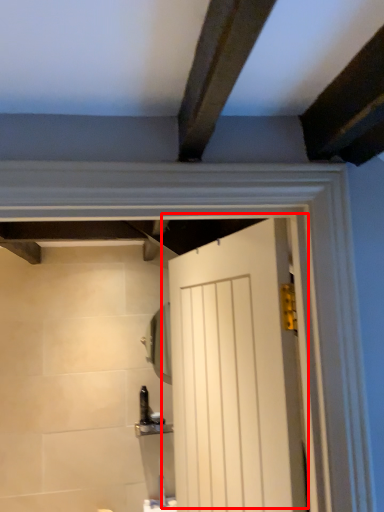
Question: Considering the relative positions of door (annotated by the red box) and mirror in the image provided, where is door (annotated by the red box) located with respect to the staircase?

Choices:
 (A) right
 (B) left

Answer: (A)